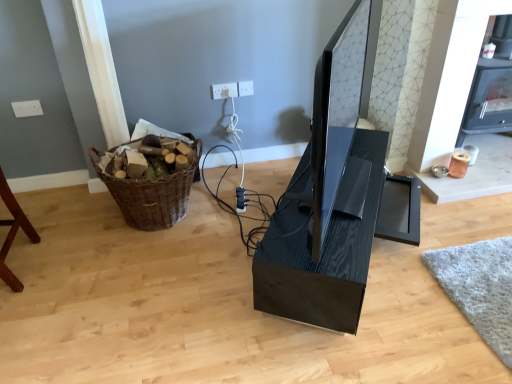
This screenshot has height=384, width=512. In order to click on free point below black glossy computer desk at center (from a real-world perspective) in this screenshot , I will do `click(371, 257)`.